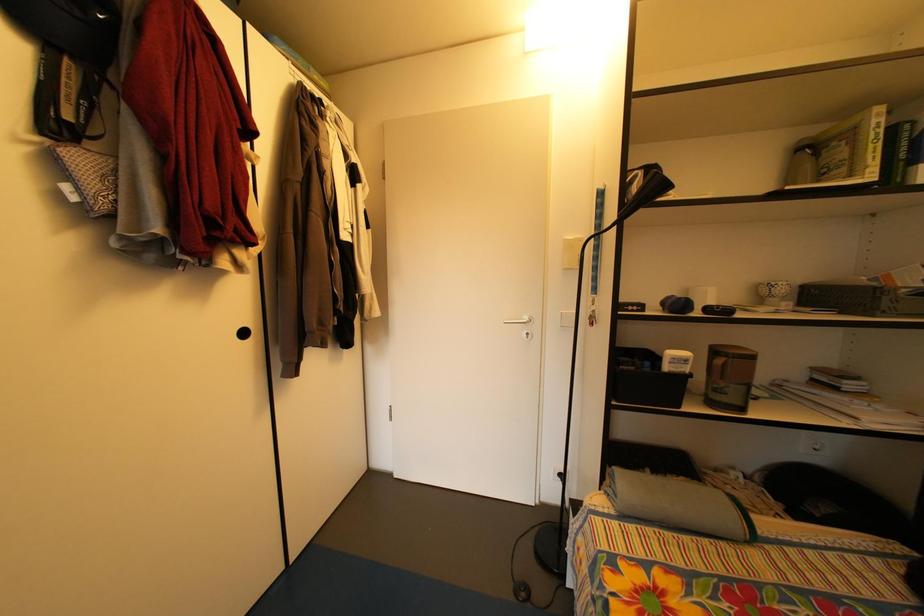
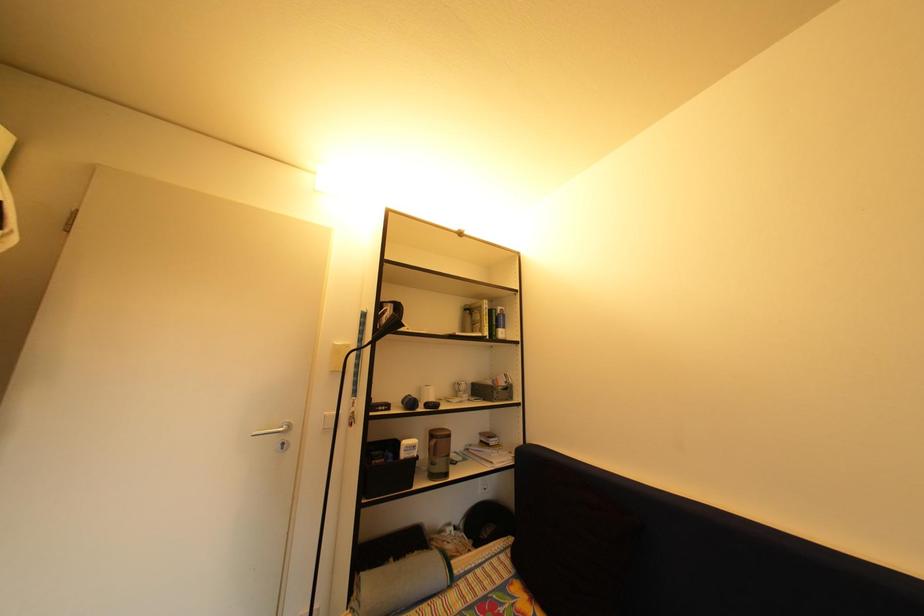
The images are taken continuously from a first-person perspective. In which direction is your viewpoint rotating?

The camera rotated toward right-up.